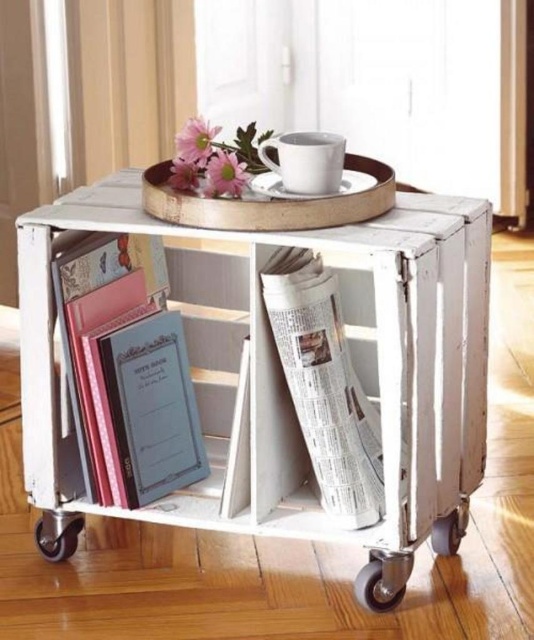
Is white paper newspaper at center thinner than black rubber wheel at lower left?

In fact, white paper newspaper at center might be wider than black rubber wheel at lower left.

Which is behind, point (284, 358) or point (65, 516)?

The point (65, 516) is behind.

Between point (331, 385) and point (52, 529), which one is positioned in front?

Positioned in front is point (331, 385).

Identify the location of white paper newspaper at center. (325, 385).

Is black rubber wheel at lower right shorter than metallic gray wheel at lower center?

Indeed, black rubber wheel at lower right has a lesser height compared to metallic gray wheel at lower center.

Can you confirm if black rubber wheel at lower right is smaller than metallic gray wheel at lower center?

Actually, black rubber wheel at lower right might be larger than metallic gray wheel at lower center.

Who is more forward, (356,582) or (450,515)?

Point (356,582) is more forward.

Find the location of a particular element. The image size is (534, 640). black rubber wheel at lower right is located at coordinates (374, 588).

Which of these two, matte blue notebook at left or black rubber wheel at lower left, stands taller?

matte blue notebook at left is taller.

Is matte blue notebook at left further to the viewer compared to black rubber wheel at lower left?

No.

Who is more distant from viewer, [111,432] or [37,520]?

The point [37,520] is behind.

I want to click on matte blue notebook at left, so click(x=127, y=371).